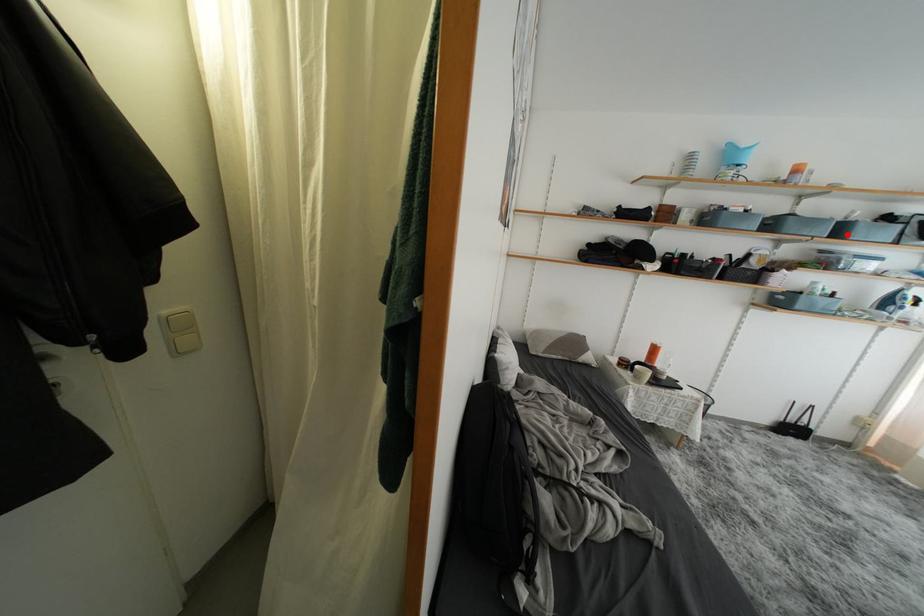
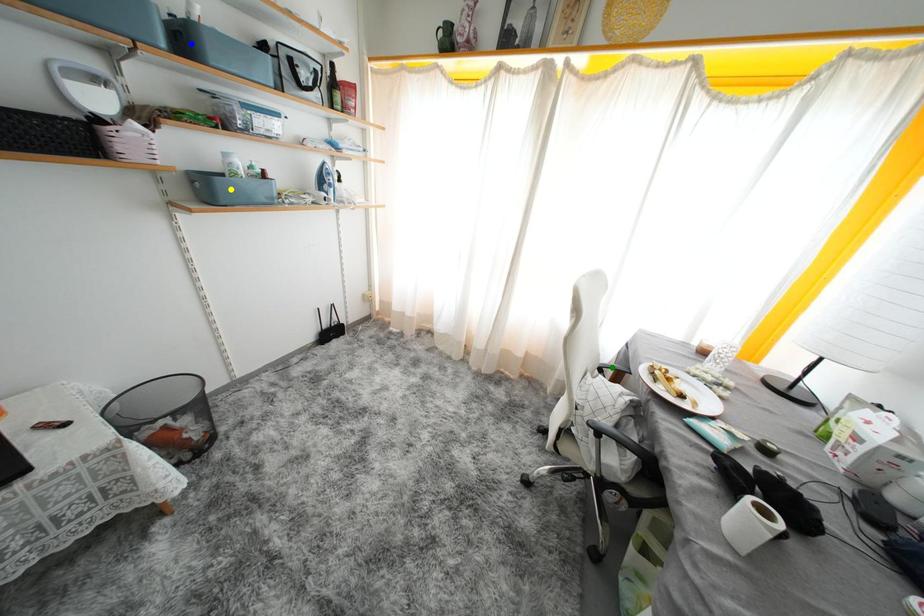
Question: I am providing you with two images of the same scene from different viewpoints. A red point is marked on the first image. You are given multiple points on the second image. Which point in image 2 represents the same 3d spot as the red point in image 1?

Choices:
 (A) blue point
 (B) yellow point
 (C) green point

Answer: (A)